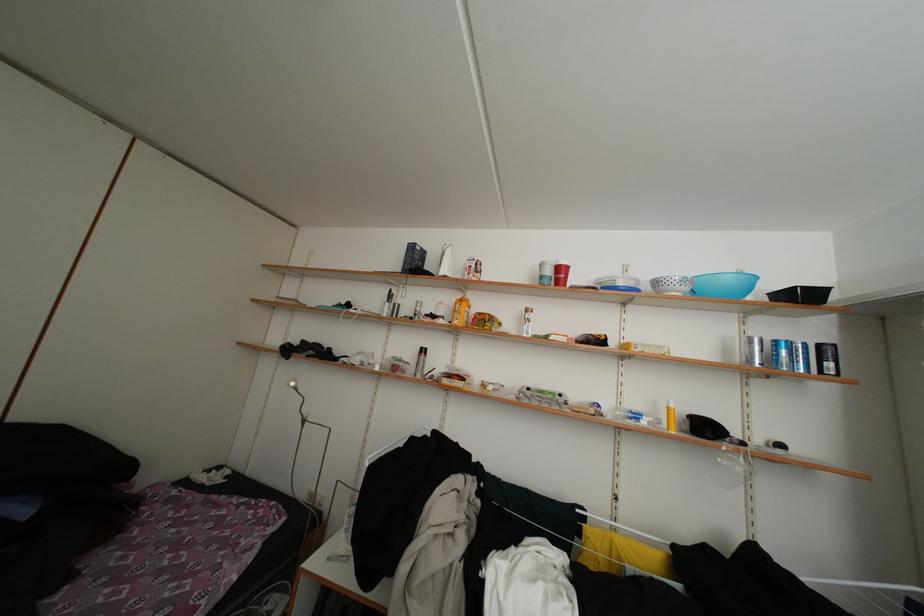
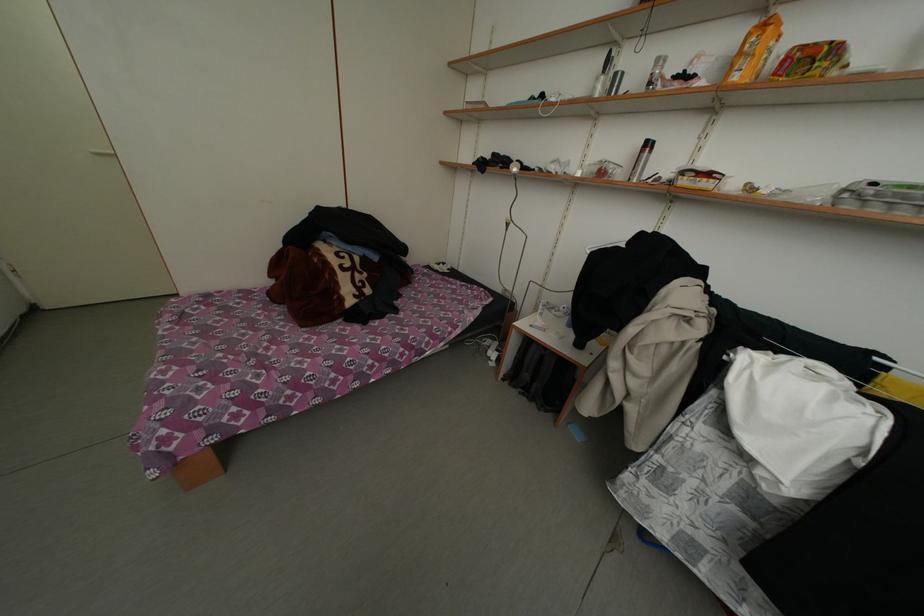
Question: I am providing you with two images of the same scene from different viewpoints. Please identify which objects are invisible in image2.

Choices:
 (A) clear egg carton
 (B) silver spray can
 (C) white cabinet handle
 (D) none of these

Answer: (D)